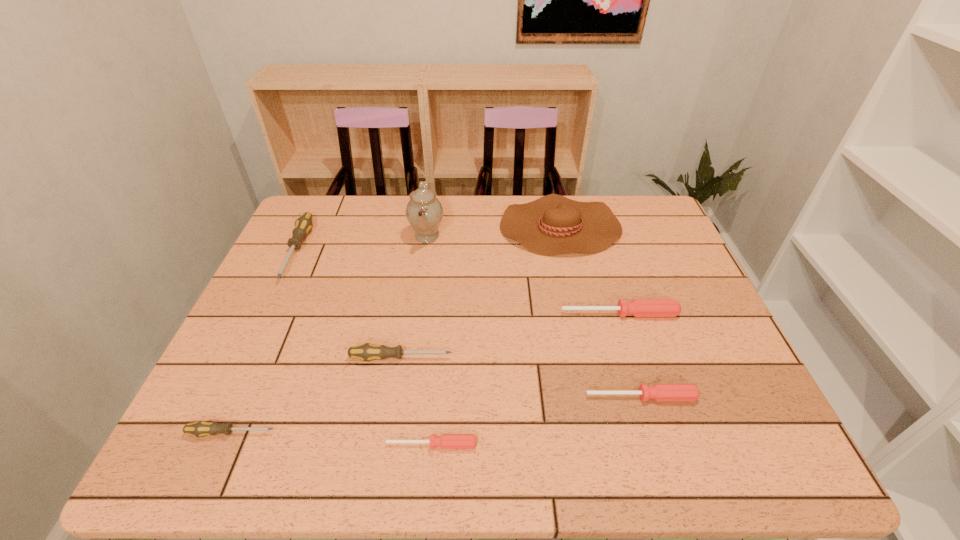
Where is `the nearest gray screwdriver`? This screenshot has height=540, width=960. the nearest gray screwdriver is located at coordinates (202, 428).

Locate an element on the screen. the leftmost red screwdriver is located at coordinates (446, 441).

I want to click on the nearest red screwdriver, so click(446, 441).

The width and height of the screenshot is (960, 540). I want to click on vacant space located 0.140m on the spout of the tallest object, so click(x=490, y=236).

What are the coordinates of `free spot located 0.130m on the front of the seventh shortest object` in the screenshot? It's located at (574, 289).

At what (x,y) coordinates should I click in order to perform the action: click on vacant space situated at the tip of the biggest gray screwdriver. Please return your answer as a coordinate pair (x, y). Image resolution: width=960 pixels, height=540 pixels. Looking at the image, I should click on (265, 319).

The image size is (960, 540). I want to click on vacant space situated 0.240m at the tip of the fourth nearest object, so click(555, 358).

Where is `free space located 0.210m on the back of the second farthest screwdriver`? The height and width of the screenshot is (540, 960). free space located 0.210m on the back of the second farthest screwdriver is located at coordinates (602, 256).

Image resolution: width=960 pixels, height=540 pixels. Identify the location of vacant space located 0.160m on the left of the second biggest red screwdriver. (512, 397).

Locate an element on the screen. This screenshot has height=540, width=960. vacant area located at the tip of the smallest gray screwdriver is located at coordinates point(335,433).